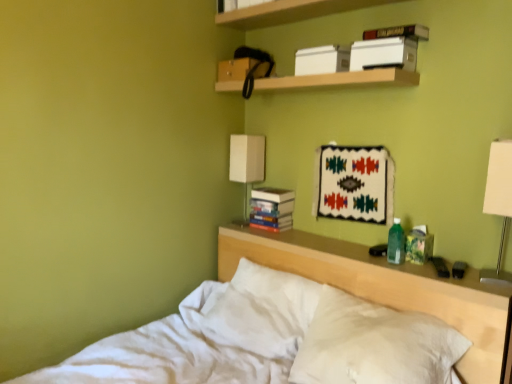
Question: From the image's perspective, is wooden shelf at upper center, the first shelf when ordered from top to bottom, positioned above or below hardcover book at upper center, marked as the 2th paperback book in a bottom-to-top arrangement?

Choices:
 (A) above
 (B) below

Answer: (A)

Question: Considering the positions of wooden shelf at upper center, which is the 2th shelf from bottom to top, and hardcover book at upper center, acting as the 1th paperback book starting from the front, in the image, is wooden shelf at upper center, which is the 2th shelf from bottom to top, taller or shorter than hardcover book at upper center, acting as the 1th paperback book starting from the front,?

Choices:
 (A) short
 (B) tall

Answer: (A)

Question: Which of these objects is positioned farthest from the white matte lampshade at upper center?

Choices:
 (A) hardcover book at upper center, marked as the 2th paperback book in a bottom-to-top arrangement
 (B) wooden shelf at upper center, the first shelf when ordered from top to bottom
 (C) white cotton bed at center
 (D) wooden shelf at upper center, which ranks as the second shelf in top-to-bottom order
 (E) white plastic lamp at right

Answer: (E)

Question: Estimate the real-world distances between objects in this image. Which object is farther from the white cotton bed at center?

Choices:
 (A) white soft pillow at center
 (B) wooden shelf at upper center, which appears as the first shelf when ordered from the bottom
 (C) hardcover book at upper center, which is the first paperback book in top-to-bottom order
 (D) white matte lampshade at upper center
 (E) hardcover books at center, the third paperback book in the front-to-back sequence

Answer: (C)